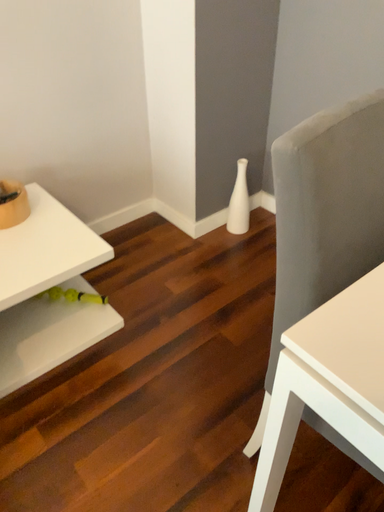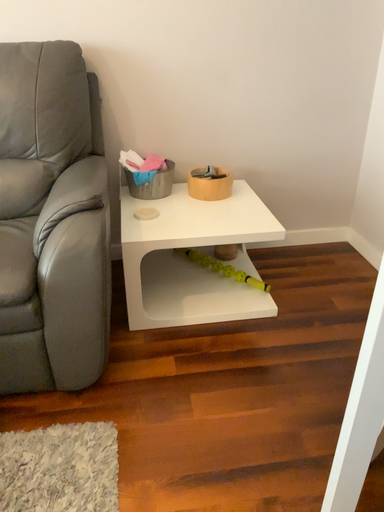
Question: Which way did the camera rotate in the video?

Choices:
 (A) rotated downward
 (B) rotated upward

Answer: (B)